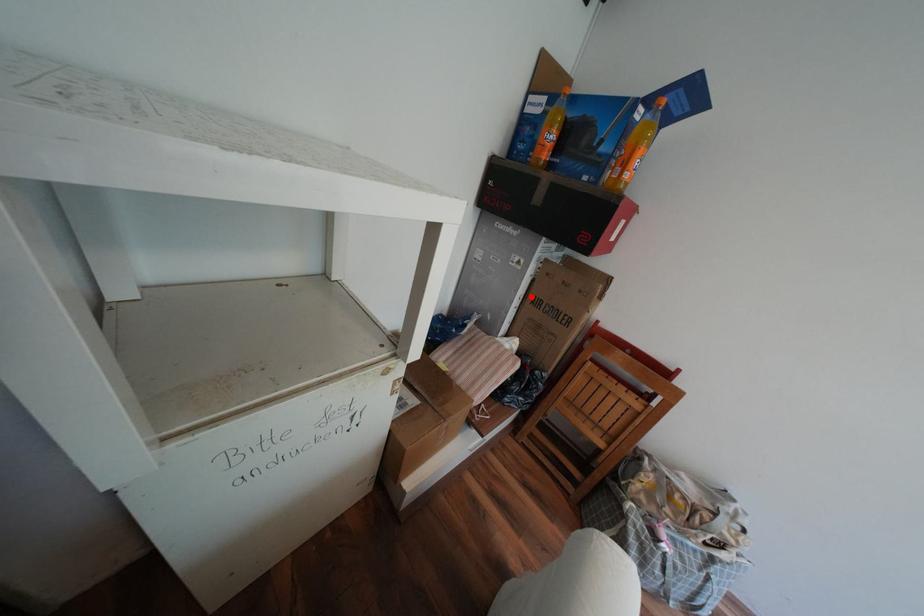
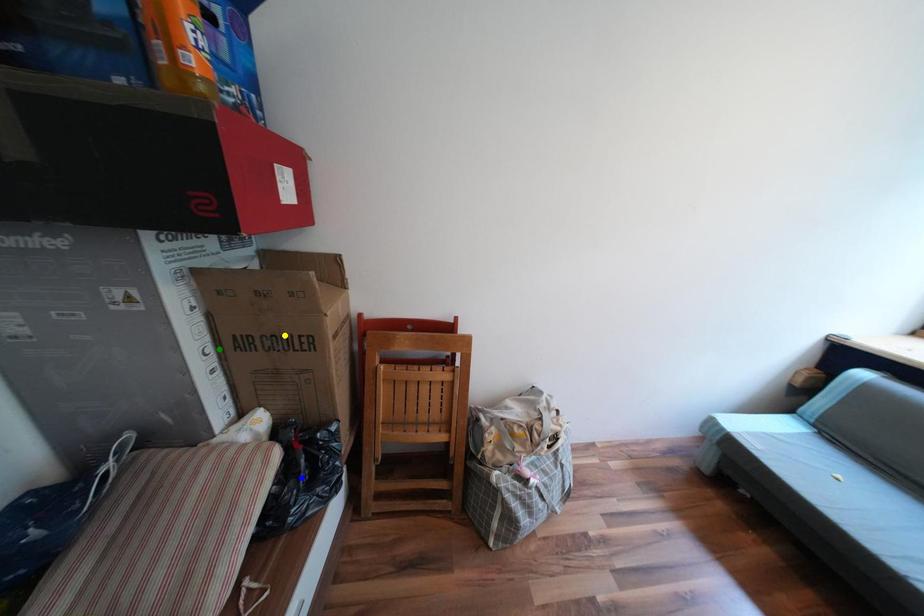
Question: I am providing you with two images of the same scene from different viewpoints. A red point is marked on the first image. You are given multiple points on the second image. In image 2, which mark is for the same physical point as the one in image 1?

Choices:
 (A) blue point
 (B) yellow point
 (C) green point

Answer: (C)